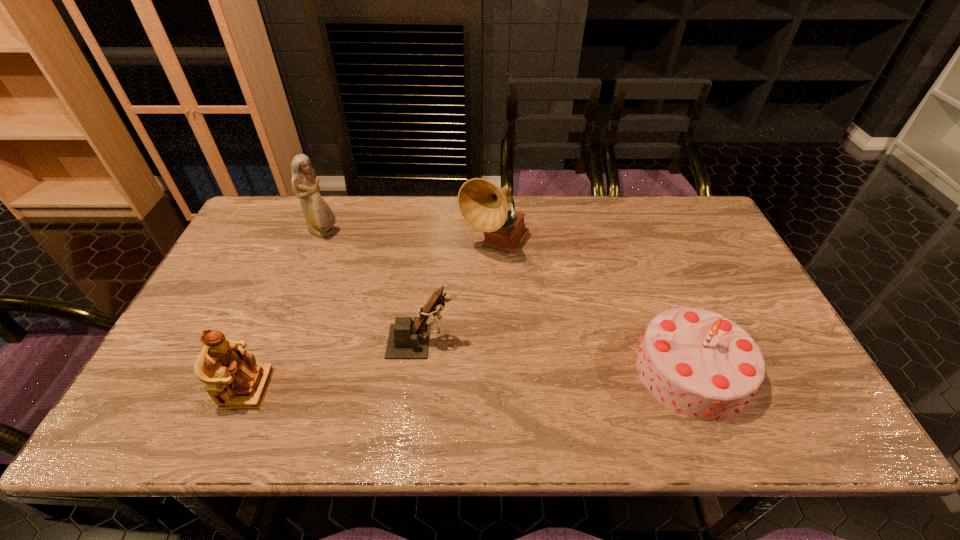
The image size is (960, 540). In order to click on figurine that is at the far edge in this screenshot , I will do `click(319, 217)`.

You are a GUI agent. You are given a task and a screenshot of the screen. Output one action in this format:
    pyautogui.click(x=<x>, y=<y>)
    Task: Click on the phonograph record that is positioned at the far edge
    
    Given the screenshot: What is the action you would take?
    pyautogui.click(x=482, y=204)

I want to click on figurine present at the near edge, so click(x=233, y=379).

Identify the location of birthday cake located in the near edge section of the desktop. (698, 363).

Identify the location of object at the right edge. [698, 363].

Where is `object that is at the near right corner`? The width and height of the screenshot is (960, 540). object that is at the near right corner is located at coordinates (698, 363).

Find the location of `vacant area at the far edge of the desktop`. vacant area at the far edge of the desktop is located at coordinates (600, 219).

Where is `vacant space at the near edge of the desktop`? This screenshot has width=960, height=540. vacant space at the near edge of the desktop is located at coordinates (759, 432).

The height and width of the screenshot is (540, 960). Find the location of `vacant space at the right edge of the desktop`. vacant space at the right edge of the desktop is located at coordinates (759, 317).

This screenshot has height=540, width=960. In order to click on vacant region at the near left corner in this screenshot , I will do `click(201, 416)`.